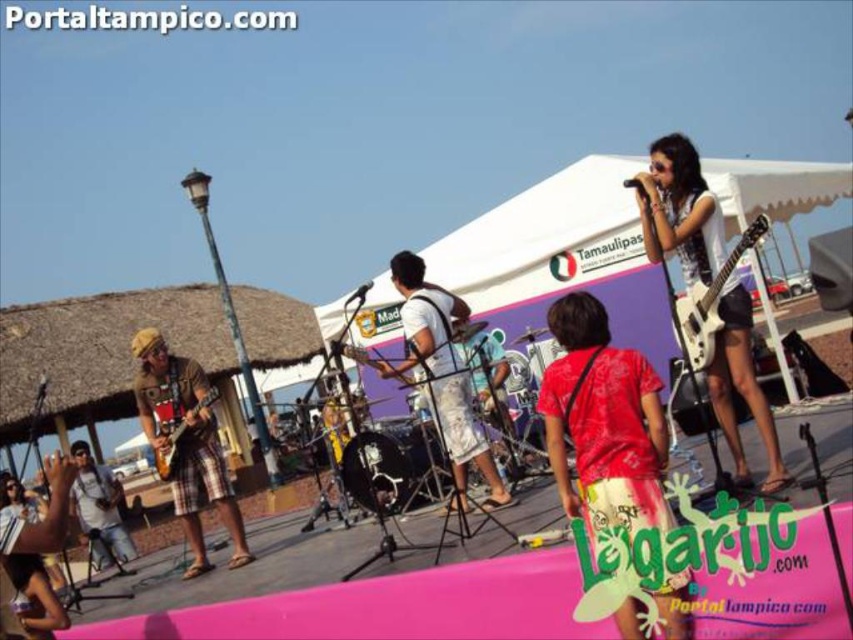
You are a stagehand who needs to move a 10 feet long ladder from the back of the stage to the front. The ladder must pass between the white glossy guitar at center and the matte white guitar at center. Can the ladder fit through the space between them?

The distance between the white glossy guitar at center and the matte white guitar at center is 8.02 feet. Since the ladder is 10 feet long, it cannot fit through the space between them as the gap is narrower than the ladder.

You are a photographer at the concert and want to capture both the brown plaid shorts at left and the matte white guitar at center in a single shot. Which object should you focus on first to ensure both are in frame?

The brown plaid shorts at left is positioned on the left side of matte white guitar at center, so you should focus on the matte white guitar at center first to ensure both are in frame as they are aligned horizontally.